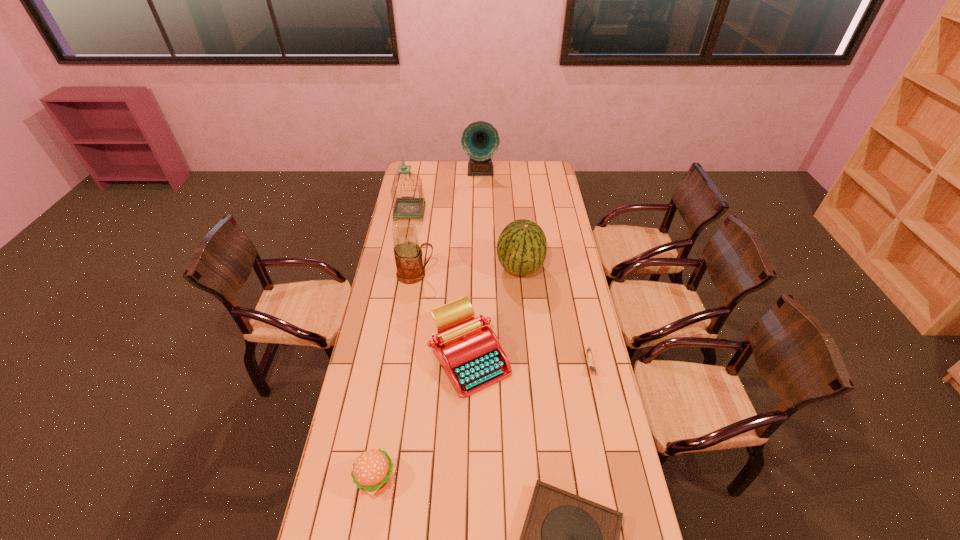
Where is `object that is the nearest to the banana`? Image resolution: width=960 pixels, height=540 pixels. object that is the nearest to the banana is located at coordinates (469, 351).

Find the location of a particular element. The width and height of the screenshot is (960, 540). object that can be found as the sixth closest to the shorter phonograph record is located at coordinates (407, 207).

Where is `free point that satisfies the following two spatial constraints: 1. from the horn of the farther phonograph record; 2. with the handle on the side of the pitcher`? The width and height of the screenshot is (960, 540). free point that satisfies the following two spatial constraints: 1. from the horn of the farther phonograph record; 2. with the handle on the side of the pitcher is located at coordinates (481, 274).

I want to click on free space that satisfies the following two spatial constraints: 1. from the horn of the farthest object; 2. on the left side of the watermelon, so click(481, 268).

This screenshot has width=960, height=540. Find the location of `free location that satisfies the following two spatial constraints: 1. at the door of the watermelon; 2. on the left side of the second farthest object`. free location that satisfies the following two spatial constraints: 1. at the door of the watermelon; 2. on the left side of the second farthest object is located at coordinates (399, 268).